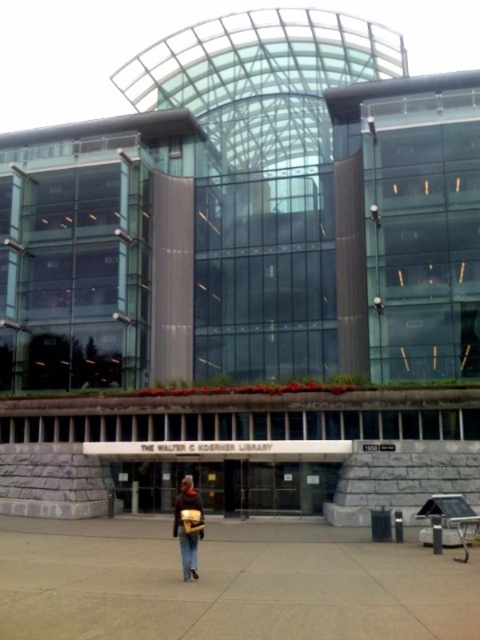
Consider the image. You are a student carrying a leather backpack at center and a brown matte jacket at lower center. You need to store both items in a locker that can only hold items smaller than the jacket. Can both items fit?

The leather backpack at center is bigger than the brown matte jacket at lower center. Since the locker can only hold items smaller than the jacket, the backpack cannot fit, but the jacket can.

You are standing at the entrance of The Walter C. Koerner Library and notice a leather backpack at center and a brown matte jacket at lower center. Which item is positioned higher relative to the other?

The leather backpack at center is positioned higher than the brown matte jacket at lower center.

From the picture: You are a delivery person standing at the entrance of The Walter C. Koerner Library. You need to place a package between the denim at lower center and the brown matte jacket at lower center. The package requires 3 meters of space. Can you fit it between them?

The denim at lower center and brown matte jacket at lower center are 2.66 meters apart from each other, so the package requiring 3 meters of space cannot fit between them.